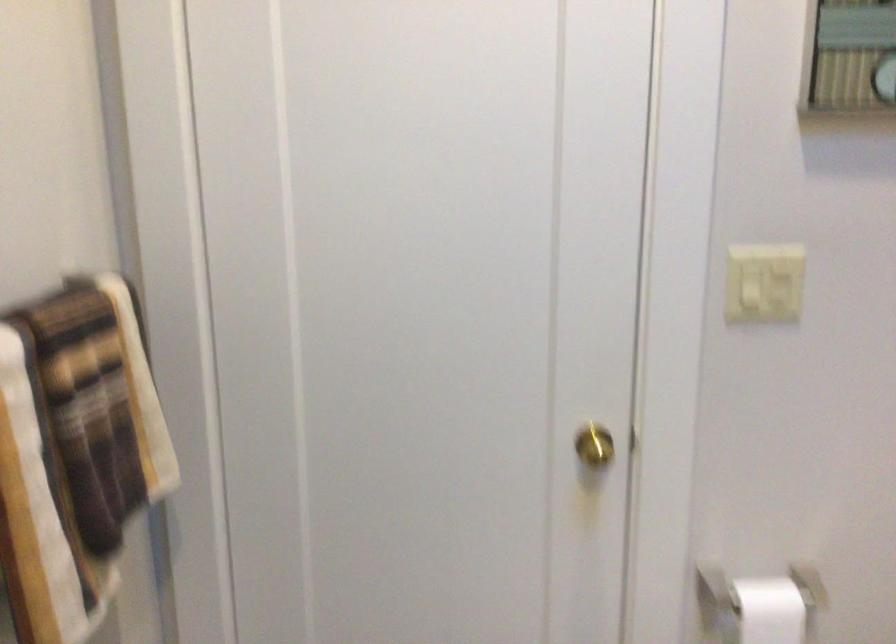
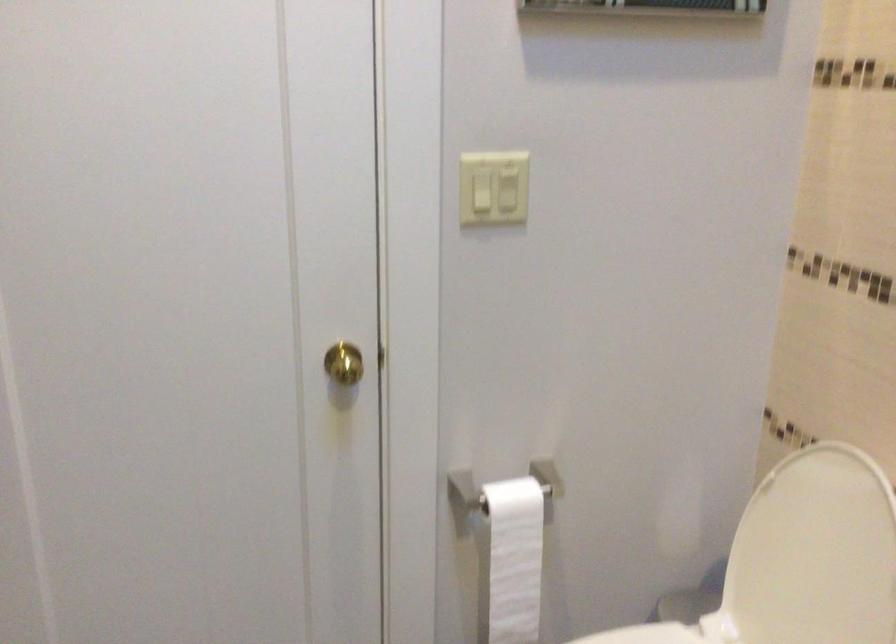
In the second image, find the point that corresponds to (779,279) in the first image.

(507, 190)